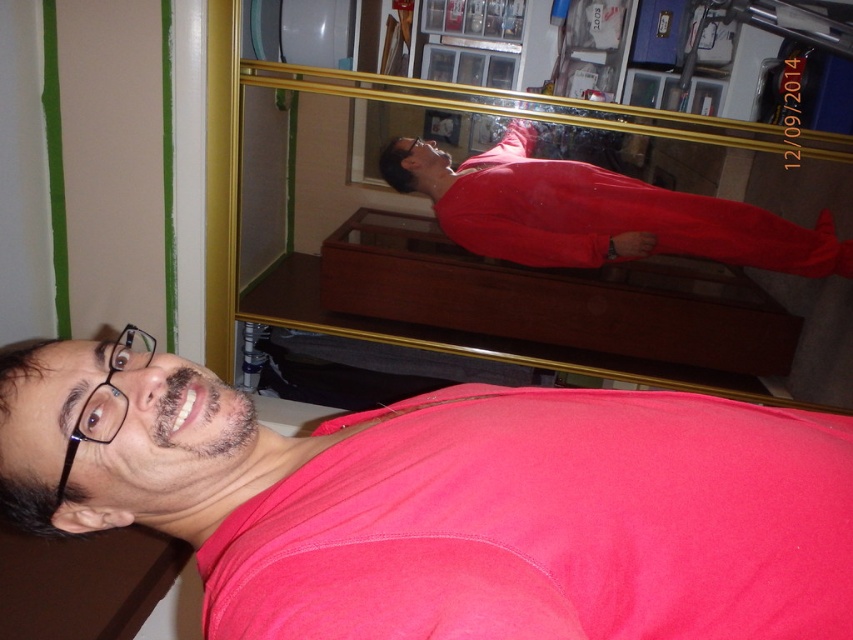
You are a photographer setting up a shot in this room. You need to position yourself so that your camera is exactly 2 meters away from the glossy glass mirror at upper center. Given the current setup, can you achieve this distance without moving the mirror?

The glossy glass mirror at upper center is currently 1.77 meters away from the camera. To reach the desired 2 meters, you would need to move the camera back by approximately 0.23 meters. Since the question allows not moving the mirror, adjusting your position should be possible unless space constraints prevent it. Thus, yes, you can achieve the required distance by moving back slightly.

You are trying to place a small decorative item on the wall at point (448, 504). The pink matte shirt at lower center is already there. Can you place your item there?

No, because the pink matte shirt at lower center is already at point (448, 504).